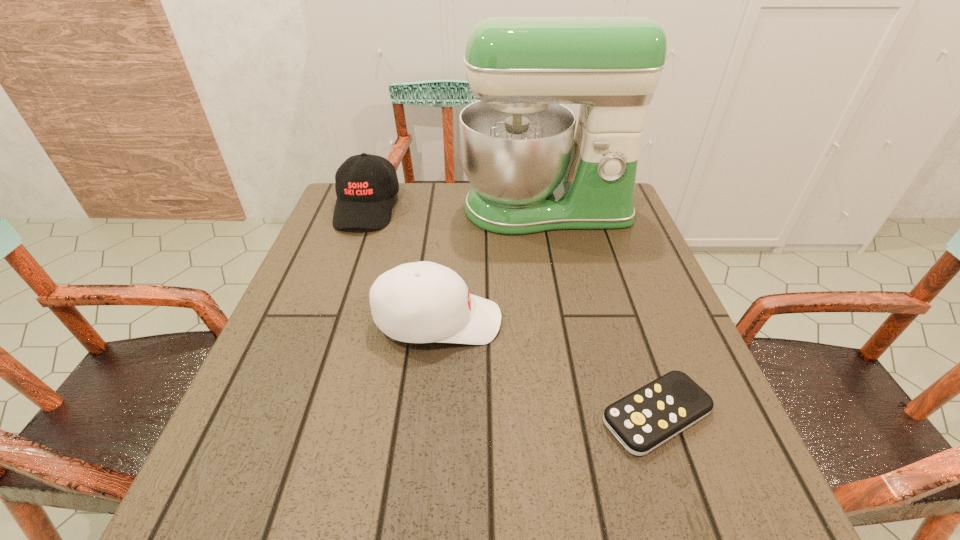
Where is `vacant space located on the left of the shortest object`? The width and height of the screenshot is (960, 540). vacant space located on the left of the shortest object is located at coordinates (499, 415).

At what (x,y) coordinates should I click in order to perform the action: click on mixer that is positioned at the far edge. Please return your answer as a coordinate pair (x, y). The height and width of the screenshot is (540, 960). Looking at the image, I should click on (530, 173).

At what (x,y) coordinates should I click in order to perform the action: click on baseball cap that is at the far edge. Please return your answer as a coordinate pair (x, y). Looking at the image, I should click on (365, 184).

Locate an element on the screen. The image size is (960, 540). object present at the left edge is located at coordinates [x=365, y=184].

Identify the location of mixer that is at the right edge. The height and width of the screenshot is (540, 960). (530, 173).

At what (x,y) coordinates should I click in order to perform the action: click on remote control located in the right edge section of the desktop. Please return your answer as a coordinate pair (x, y). This screenshot has width=960, height=540. Looking at the image, I should click on (641, 421).

Image resolution: width=960 pixels, height=540 pixels. What are the coordinates of `object that is at the far left corner` in the screenshot? It's located at tap(365, 184).

Where is `object positioned at the far right corner`? The height and width of the screenshot is (540, 960). object positioned at the far right corner is located at coordinates (530, 173).

In the image, there is a desktop. Where is `vacant region at the far edge`? vacant region at the far edge is located at coordinates (445, 203).

In the image, there is a desktop. In order to click on vacant space at the left edge in this screenshot , I will do `click(341, 259)`.